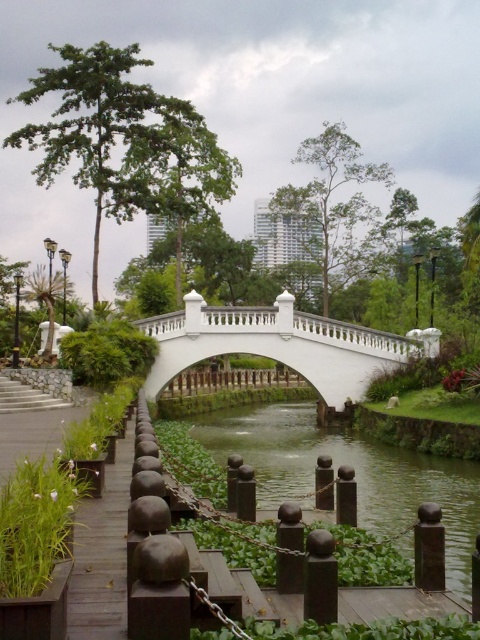
Can you confirm if white marble bridge at center is positioned below wooden planks at lower left?

No, white marble bridge at center is not below wooden planks at lower left.

Does white marble bridge at center appear over wooden planks at lower left?

Correct, white marble bridge at center is located above wooden planks at lower left.

Which is in front, point (181, 321) or point (80, 564)?

Point (80, 564) is more forward.

At what (x,y) coordinates should I click in order to perform the action: click on white marble bridge at center. Please return your answer as a coordinate pair (x, y). Looking at the image, I should click on (280, 344).

Can you confirm if green mossy river at center is shorter than white marble bridge at center?

Yes, green mossy river at center is shorter than white marble bridge at center.

Between point (261, 490) and point (322, 378), which one is positioned in front?

Point (261, 490) is more forward.

Between point (387, 493) and point (151, 333), which one is positioned in front?

Positioned in front is point (387, 493).

Find the location of `green mossy river at center`. green mossy river at center is located at coordinates (356, 474).

Does green mossy river at center have a greater height compared to wooden planks at lower left?

Indeed, green mossy river at center has a greater height compared to wooden planks at lower left.

What do you see at coordinates (356, 474) in the screenshot?
I see `green mossy river at center` at bounding box center [356, 474].

This screenshot has width=480, height=640. I want to click on green mossy river at center, so click(x=356, y=474).